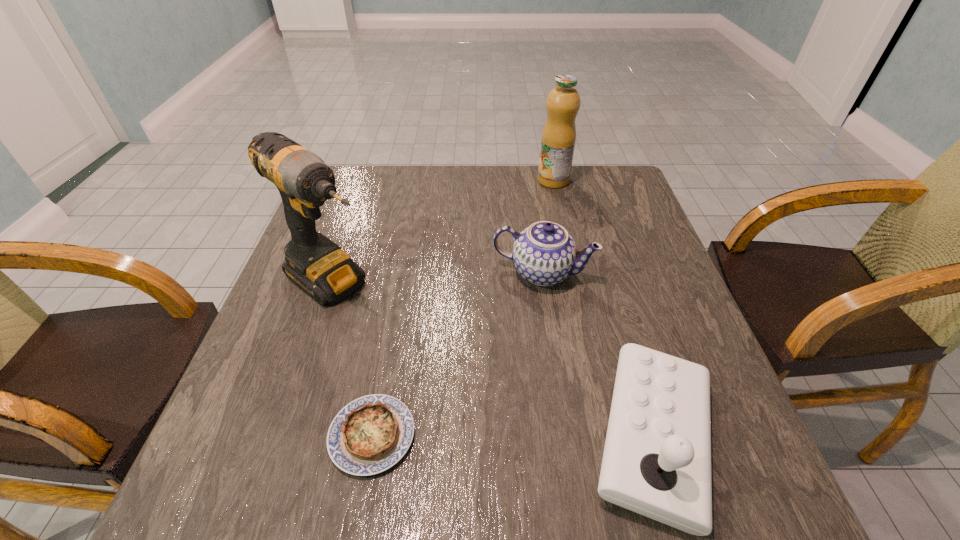
Locate an element on the screen. Image resolution: width=960 pixels, height=540 pixels. free location at the right edge of the desktop is located at coordinates (656, 287).

At what (x,y) coordinates should I click in order to perform the action: click on vacant space at the far left corner of the desktop. Please return your answer as a coordinate pair (x, y). The height and width of the screenshot is (540, 960). Looking at the image, I should click on (364, 199).

The image size is (960, 540). I want to click on vacant space at the near left corner, so click(265, 438).

Identify the location of free space at the far right corner. The height and width of the screenshot is (540, 960). (580, 169).

Locate an element on the screen. vacant region between the farthest object and the drill is located at coordinates (444, 231).

Locate an element on the screen. This screenshot has width=960, height=540. free space between the drill and the chinaware is located at coordinates (438, 277).

The width and height of the screenshot is (960, 540). What are the coordinates of `empty location between the drill and the quiche` in the screenshot? It's located at point(352,359).

Find the location of a particular element. the third closest object to the joystick is located at coordinates (317, 265).

Choose which object is the nearest neighbor to the drill. Please provide its 2D coordinates. Your answer should be formatted as a tuple, i.e. [(x, y)], where the tuple contains the x and y coordinates of a point satisfying the conditions above.

[(369, 435)]

Where is `vacant region that satisfies the following two spatial constraints: 1. on the front side of the drill; 2. on the right side of the quiche`? The height and width of the screenshot is (540, 960). vacant region that satisfies the following two spatial constraints: 1. on the front side of the drill; 2. on the right side of the quiche is located at coordinates (281, 435).